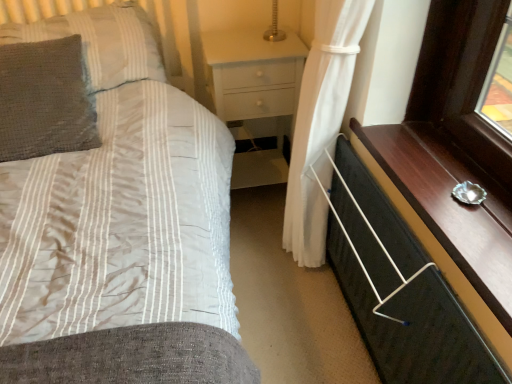
At what (x,y) coordinates should I click in order to perform the action: click on space that is in front of white glossy nightstand at center. Please return your answer as a coordinate pair (x, y). Image resolution: width=512 pixels, height=384 pixels. Looking at the image, I should click on (257, 240).